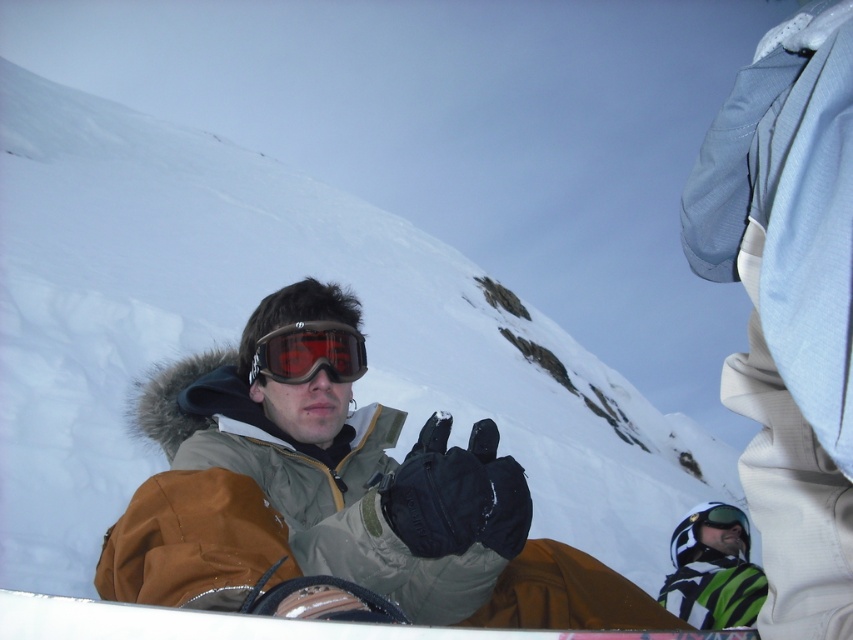
You are a photographer standing at the edge of a snowy slope. You want to take a picture of the brown leather snowboard at lower center. If your camera has a minimum focus distance of 35 feet, will you be able to capture the snowboard clearly?

The brown leather snowboard at lower center is 36.96 feet away from the camera. Since this distance exceeds the camera minimum focus distance of 35 feet, the camera can focus on the snowboard and capture it clearly.

You are a photographer trying to capture the brown leather snowboard at lower center and the matte black goggles at center in a single shot. Since you want to ensure both are clearly visible, which object should you focus on first to account for their sizes?

The brown leather snowboard at lower center is taller than the matte black goggles at center. Therefore, you should focus on the brown leather snowboard at lower center first as it occupies more space in the frame, ensuring its clarity before adjusting for the smaller matte black goggles at center.